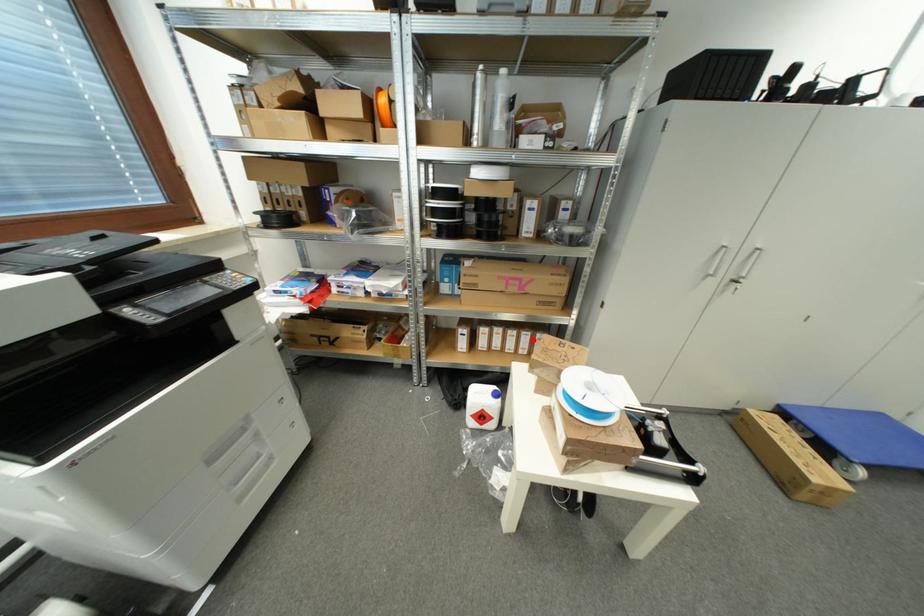
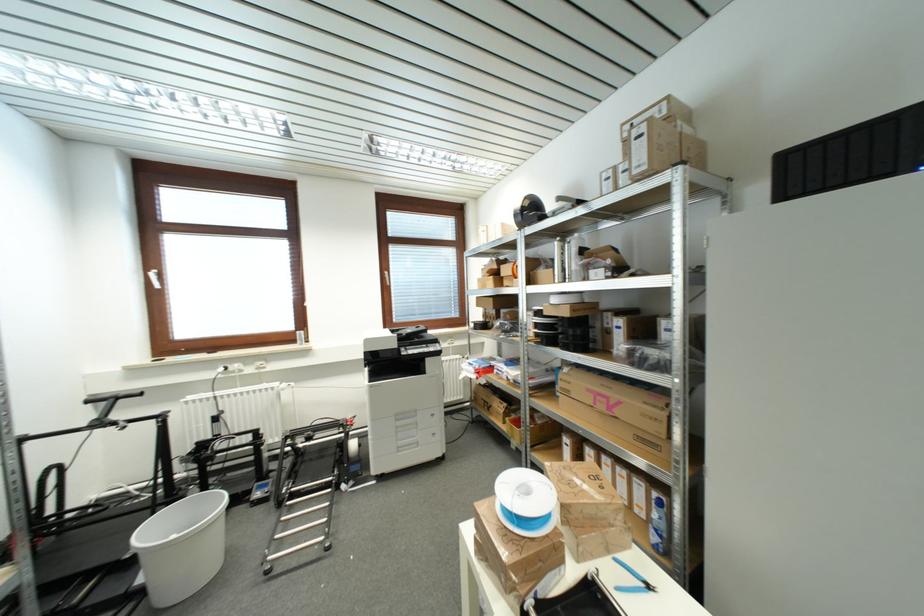
The point at the highlighted location is marked in the first image. Where is the corresponding point in the second image?

(648, 493)